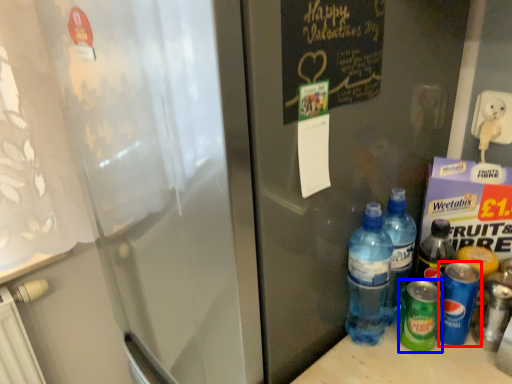
Question: Which object is closer to the camera taking this photo, bottle (highlighted by a red box) or bottle (highlighted by a blue box)?

Choices:
 (A) bottle
 (B) bottle

Answer: (A)